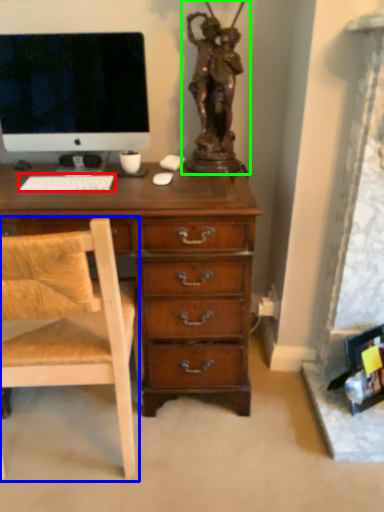
Question: Which object is positioned farthest from computer keyboard (highlighted by a red box)? Select from chair (highlighted by a blue box) and sculpture (highlighted by a green box).

Choices:
 (A) chair
 (B) sculpture

Answer: (B)